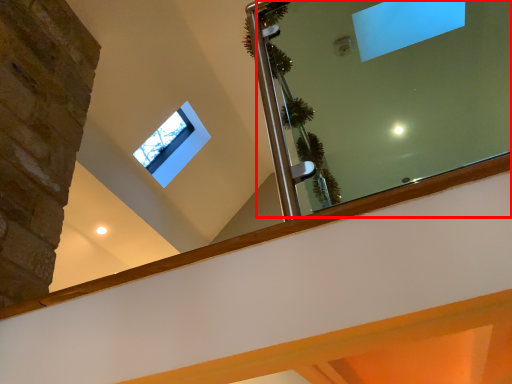
Question: From the image's perspective, what is the correct spatial relationship of mirror (annotated by the red box) in relation to window?

Choices:
 (A) above
 (B) below

Answer: (A)